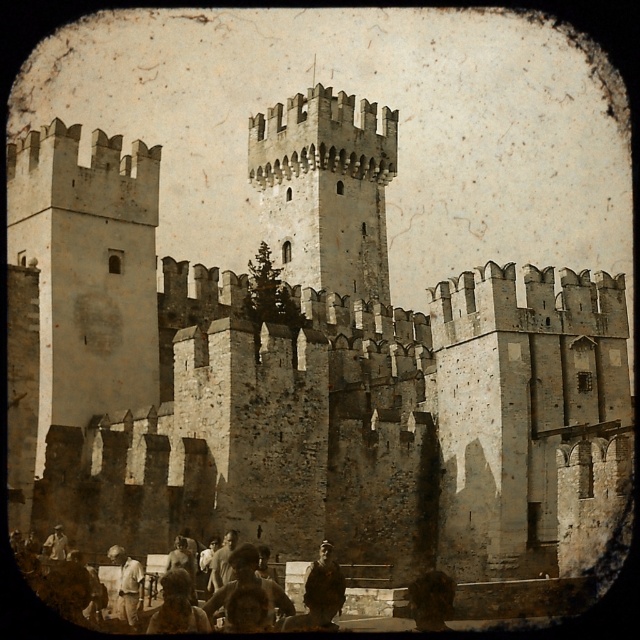
Consider the image. Is stone textured tower at center in front of dark brown leather jacket at center?

No.

Describe the element at coordinates (324, 189) in the screenshot. The image size is (640, 640). I see `stone textured tower at center` at that location.

Find the location of a particular element. This screenshot has width=640, height=640. stone textured tower at center is located at coordinates (324, 189).

Measure the distance between point (316, 618) and camera.

51.35 meters

Is point (323, 612) closer to camera compared to point (284, 593)?

Yes, it is in front of point (284, 593).

What do you see at coordinates (323, 589) in the screenshot? I see `dark brown leather jacket at center` at bounding box center [323, 589].

Find the location of a particular element. Image resolution: width=640 pixels, height=640 pixels. dark brown leather jacket at center is located at coordinates (323, 589).

Which is above, brown textured hair at lower center or light brown leather jacket at lower center?

light brown leather jacket at lower center is higher up.

Is brown textured hair at lower center positioned in front of light brown leather jacket at lower center?

Yes.

Where is `brown textured hair at lower center`? Image resolution: width=640 pixels, height=640 pixels. brown textured hair at lower center is located at coordinates (248, 580).

Locate an element on the screen. This screenshot has width=640, height=640. brown textured hair at lower center is located at coordinates (248, 580).